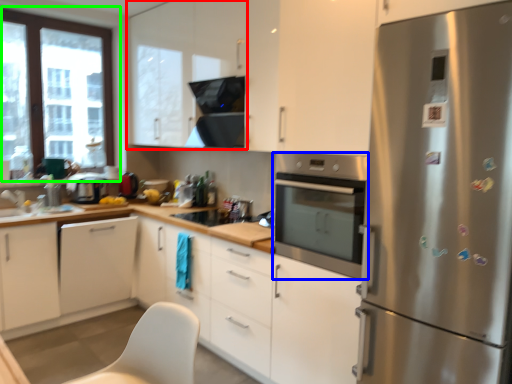
Question: Considering the real-world distances, which object is closest to cabinetry (highlighted by a red box)? home appliance (highlighted by a blue box) or window (highlighted by a green box).

Choices:
 (A) home appliance
 (B) window

Answer: (B)